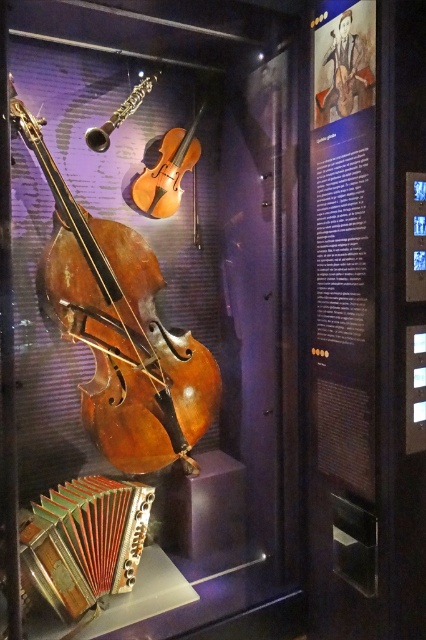
You are a museum visitor standing in front of the display case. You notice the wooden polished cello at center. Can you determine its exact position within the case using the coordinate system provided?

The wooden polished cello at center is located at point (120, 330) according to the coordinate system provided.

You are standing in front of the museum display case and want to touch the point at coordinates point (x=126, y=257). Can you reach it without moving your position?

The point (x=126, y=257) is 2.03 meters away from the viewer, so unless you have an arm span longer than 2.03 meters, you cannot reach it without moving your position.